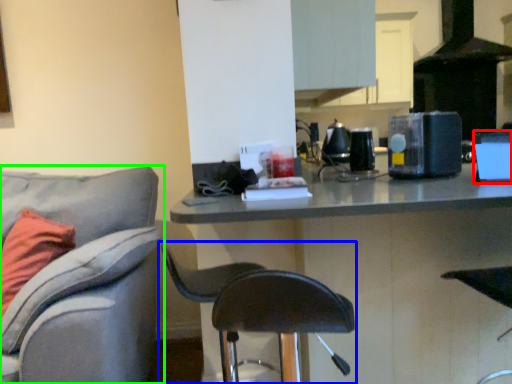
Question: Based on their relative distances, which object is nearer to appliance (highlighted by a red box)? Choose from chair (highlighted by a blue box) and chair (highlighted by a green box).

Choices:
 (A) chair
 (B) chair

Answer: (A)